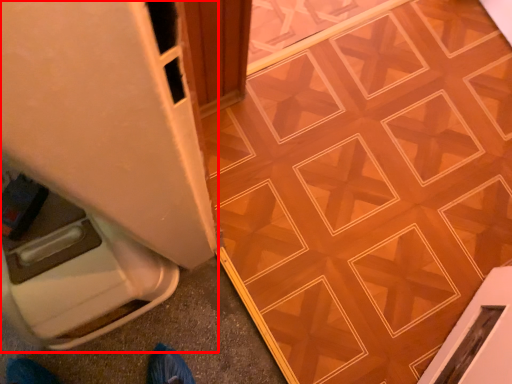
Question: From the image's perspective, what is the correct spatial relationship of appliance (annotated by the red box) in relation to ceramic tile?

Choices:
 (A) below
 (B) above

Answer: (A)